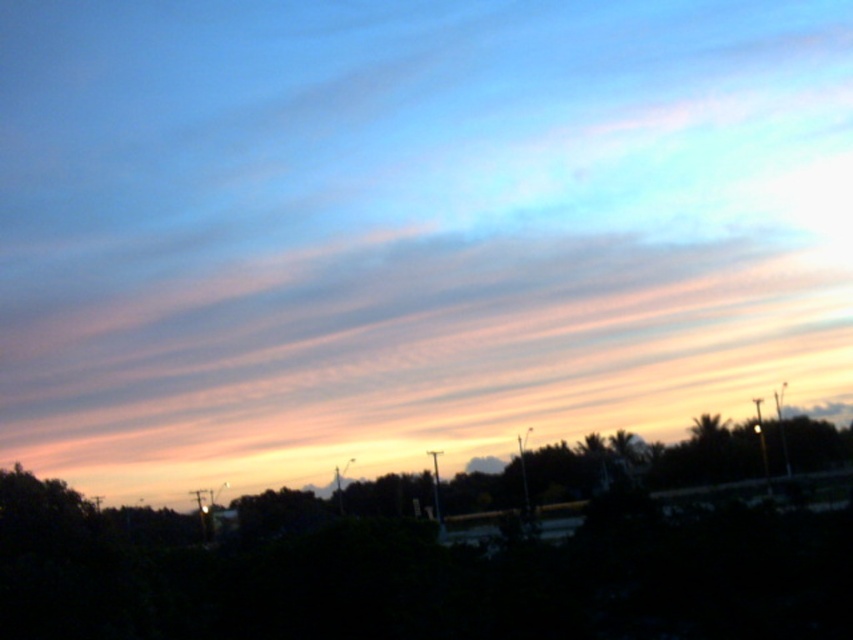
Question: Does pink translucent clouds at upper center have a lesser width compared to dark green leafy tree at lower center?

Choices:
 (A) no
 (B) yes

Answer: (A)

Question: Can you confirm if pink translucent clouds at upper center is positioned below dark green leafy tree at lower center?

Choices:
 (A) yes
 (B) no

Answer: (B)

Question: Among these objects, which one is nearest to the camera?

Choices:
 (A) dark green leafy tree at lower center
 (B) pink translucent clouds at upper center

Answer: (A)

Question: Observing the image, what is the correct spatial positioning of pink translucent clouds at upper center in reference to dark green leafy tree at lower center?

Choices:
 (A) above
 (B) below

Answer: (A)